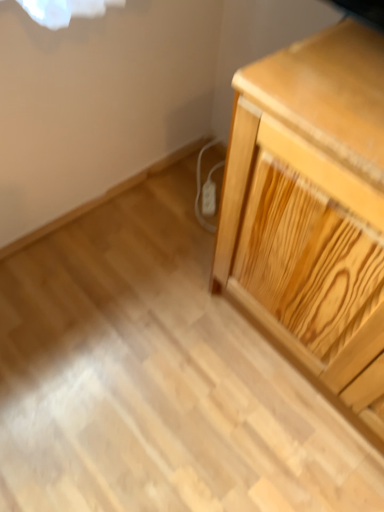
Locate an element on the screen. This screenshot has height=512, width=384. vacant region to the left of white plastic electric outlet at lower center is located at coordinates (173, 198).